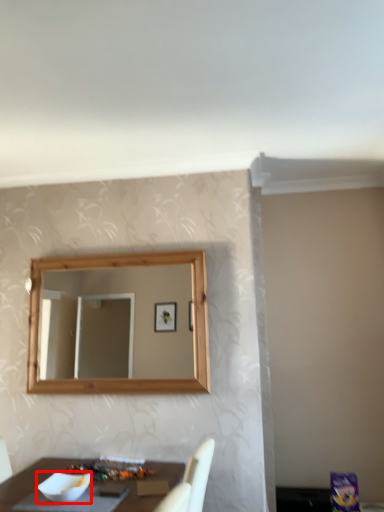
Question: From the image's perspective, what is the correct spatial relationship of bowl (annotated by the red box) in relation to food?

Choices:
 (A) above
 (B) below

Answer: (A)